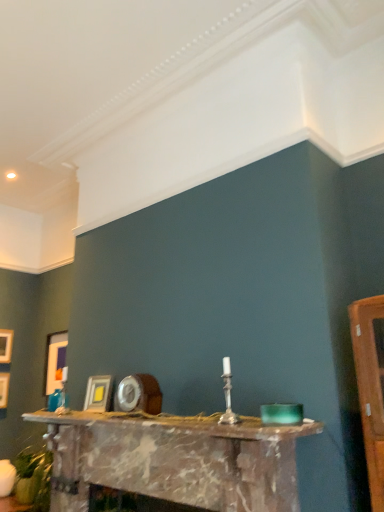
Measure the distance between point (90, 378) and camera.

They are 2.68 meters apart.

Locate an element on the screen. This screenshot has height=512, width=384. wooden picture frame at left, positioned as the 4th picture frame in front-to-back order is located at coordinates (6, 345).

This screenshot has height=512, width=384. Describe the element at coordinates (174, 460) in the screenshot. I see `marble fireplace at center` at that location.

Measure the distance between matte white picture frame at left, the 3th picture frame in the back-to-front sequence, and camera.

The depth of matte white picture frame at left, the 3th picture frame in the back-to-front sequence, is 3.53 meters.

Image resolution: width=384 pixels, height=512 pixels. Identify the location of matte white picture frame at left, which ranks as the third picture frame in left-to-right order. (55, 361).

Locate an element on the screen. The width and height of the screenshot is (384, 512). matte gold picture frame at center, the 1th picture frame viewed from the front is located at coordinates (98, 393).

Considering the sizes of objects matte gold picture frame at center, marked as the fourth picture frame in a back-to-front arrangement, and matte white picture frame at left, which ranks as the third picture frame in left-to-right order, in the image provided, who is smaller, matte gold picture frame at center, marked as the fourth picture frame in a back-to-front arrangement, or matte white picture frame at left, which ranks as the third picture frame in left-to-right order,?

Smaller between the two is matte gold picture frame at center, marked as the fourth picture frame in a back-to-front arrangement.

Does matte gold picture frame at center, the 1th picture frame viewed from the front, appear on the left side of matte white picture frame at left, the second picture frame from the front?

No.

From the image's perspective, is matte gold picture frame at center, the 1th picture frame from the right, located beneath matte white picture frame at left, the 3th picture frame in the back-to-front sequence?

No, from the image's perspective, matte gold picture frame at center, the 1th picture frame from the right, is not beneath matte white picture frame at left, the 3th picture frame in the back-to-front sequence.

Identify the location of picture frame that is the 1st one when counting backward from the matte gold picture frame at center, the 1th picture frame viewed from the front. Image resolution: width=384 pixels, height=512 pixels. (55, 361).

Is matte gold picture frame at left, arranged as the third picture frame when viewed from the right, bigger than wooden picture frame at left, which appears as the 1th picture frame when viewed from the back?

Yes.

Is matte gold picture frame at left, the third picture frame viewed from the front, situated inside wooden picture frame at left, the fourth picture frame in the right-to-left sequence, or outside?

matte gold picture frame at left, the third picture frame viewed from the front, is spatially situated outside wooden picture frame at left, the fourth picture frame in the right-to-left sequence.

In terms of width, does matte gold picture frame at left, which ranks as the second picture frame in back-to-front order, look wider or thinner when compared to wooden picture frame at left, the fourth picture frame in the right-to-left sequence?

Clearly, matte gold picture frame at left, which ranks as the second picture frame in back-to-front order, has more width compared to wooden picture frame at left, the fourth picture frame in the right-to-left sequence.

Would you consider matte gold picture frame at left, arranged as the third picture frame when viewed from the right, to be distant from wooden picture frame at left, the fourth picture frame in the right-to-left sequence?

No, there isn't a large distance between matte gold picture frame at left, arranged as the third picture frame when viewed from the right, and wooden picture frame at left, the fourth picture frame in the right-to-left sequence.

Does matte gold picture frame at left, the third picture frame viewed from the front, have a greater height compared to matte gold picture frame at center, the 4th picture frame positioned from the left?

Correct, matte gold picture frame at left, the third picture frame viewed from the front, is much taller as matte gold picture frame at center, the 4th picture frame positioned from the left.

Is point (1, 382) closer to camera compared to point (103, 382)?

No, (1, 382) is further to viewer.

How different are the orientations of matte gold picture frame at left, which ranks as the second picture frame in left-to-right order, and matte gold picture frame at center, the 1th picture frame viewed from the front, in degrees?

The facing directions of matte gold picture frame at left, which ranks as the second picture frame in left-to-right order, and matte gold picture frame at center, the 1th picture frame viewed from the front, are 90.4 degrees apart.

Considering the relative positions of matte white picture frame at left, the 3th picture frame in the back-to-front sequence, and marble fireplace at center in the image provided, is matte white picture frame at left, the 3th picture frame in the back-to-front sequence, to the left of marble fireplace at center from the viewer's perspective?

Yes.

From the image's perspective, is matte white picture frame at left, which ranks as the third picture frame in left-to-right order, above marble fireplace at center?

Indeed, from the image's perspective, matte white picture frame at left, which ranks as the third picture frame in left-to-right order, is shown above marble fireplace at center.

Is matte white picture frame at left, which ranks as the third picture frame in left-to-right order, far from marble fireplace at center?

matte white picture frame at left, which ranks as the third picture frame in left-to-right order, is far away from marble fireplace at center.

From the image's perspective, which is above, wooden picture frame at left, which appears as the 1th picture frame when viewed from the back, or matte gold picture frame at center, the 1th picture frame from the right?

wooden picture frame at left, which appears as the 1th picture frame when viewed from the back.

How distant is wooden picture frame at left, positioned as the first picture frame in left-to-right order, from matte gold picture frame at center, the 1th picture frame from the right?

wooden picture frame at left, positioned as the first picture frame in left-to-right order, and matte gold picture frame at center, the 1th picture frame from the right, are 1.59 meters apart from each other.

Considering the positions of objects wooden picture frame at left, which appears as the 1th picture frame when viewed from the back, and matte gold picture frame at center, marked as the fourth picture frame in a back-to-front arrangement, in the image provided, who is more to the left, wooden picture frame at left, which appears as the 1th picture frame when viewed from the back, or matte gold picture frame at center, marked as the fourth picture frame in a back-to-front arrangement,?

wooden picture frame at left, which appears as the 1th picture frame when viewed from the back.

Starting from the matte gold picture frame at center, marked as the fourth picture frame in a back-to-front arrangement, which picture frame is the 3rd one to the left? Please provide its 2D coordinates.

[(6, 345)]

Which point is more distant from viewer, (95, 408) or (7, 345)?

The point (7, 345) is farther.

Can you confirm if matte gold picture frame at center, the 4th picture frame positioned from the left, is positioned to the right of wooden picture frame at left, which appears as the 1th picture frame when viewed from the back?

Yes, matte gold picture frame at center, the 4th picture frame positioned from the left, is to the right of wooden picture frame at left, which appears as the 1th picture frame when viewed from the back.

Can you tell me how much matte gold picture frame at center, marked as the fourth picture frame in a back-to-front arrangement, and wooden picture frame at left, the fourth picture frame in the right-to-left sequence, differ in facing direction?

There is a 90.4-degree angle between the facing directions of matte gold picture frame at center, marked as the fourth picture frame in a back-to-front arrangement, and wooden picture frame at left, the fourth picture frame in the right-to-left sequence.

In the scene shown: Does marble fireplace at center have a smaller size compared to matte gold picture frame at center, the 4th picture frame positioned from the left?

No, marble fireplace at center is not smaller than matte gold picture frame at center, the 4th picture frame positioned from the left.

Looking at this image, is marble fireplace at center not near matte gold picture frame at center, the 1th picture frame from the right?

marble fireplace at center is near matte gold picture frame at center, the 1th picture frame from the right, not far away.

In the scene shown: From the image's perspective, is marble fireplace at center beneath matte gold picture frame at center, marked as the fourth picture frame in a back-to-front arrangement?

Yes, from the image's perspective, marble fireplace at center is below matte gold picture frame at center, marked as the fourth picture frame in a back-to-front arrangement.

From a real-world perspective, does marble fireplace at center stand above matte gold picture frame at center, the 1th picture frame from the right?

No.

Which picture frame is the 1st one when counting from the left side of the matte gold picture frame at center, the 1th picture frame from the right? Please provide its 2D coordinates.

[(55, 361)]

The height and width of the screenshot is (512, 384). Find the location of `the 2nd picture frame positioned below the wooden picture frame at left, positioned as the 4th picture frame in front-to-back order (from a real-world perspective)`. the 2nd picture frame positioned below the wooden picture frame at left, positioned as the 4th picture frame in front-to-back order (from a real-world perspective) is located at coordinates (4, 389).

Considering their positions, is matte gold picture frame at left, arranged as the third picture frame when viewed from the right, positioned closer to wooden picture frame at left, which appears as the 1th picture frame when viewed from the back, than matte white picture frame at left, the second picture frame from the front?

matte gold picture frame at left, arranged as the third picture frame when viewed from the right, is closer to wooden picture frame at left, which appears as the 1th picture frame when viewed from the back.

Considering their positions, is matte gold picture frame at center, the 1th picture frame from the right, positioned closer to matte white picture frame at left, the 3th picture frame in the back-to-front sequence, than matte gold picture frame at left, which ranks as the second picture frame in left-to-right order?

matte gold picture frame at left, which ranks as the second picture frame in left-to-right order, is closer to matte white picture frame at left, the 3th picture frame in the back-to-front sequence.

Estimate the real-world distances between objects in this image. Which object is closer to matte white picture frame at left, the second picture frame in the right-to-left sequence, marble fireplace at center or matte gold picture frame at center, marked as the fourth picture frame in a back-to-front arrangement?

Among the two, matte gold picture frame at center, marked as the fourth picture frame in a back-to-front arrangement, is located nearer to matte white picture frame at left, the second picture frame in the right-to-left sequence.

Considering their positions, is marble fireplace at center positioned closer to wooden picture frame at left, the fourth picture frame in the right-to-left sequence, than matte gold picture frame at left, arranged as the third picture frame when viewed from the right?

matte gold picture frame at left, arranged as the third picture frame when viewed from the right, lies closer to wooden picture frame at left, the fourth picture frame in the right-to-left sequence, than the other object.

From the picture: From the image, which object appears to be nearer to marble fireplace at center, wooden picture frame at left, positioned as the first picture frame in left-to-right order, or matte white picture frame at left, the 3th picture frame in the back-to-front sequence?

Among the two, matte white picture frame at left, the 3th picture frame in the back-to-front sequence, is located nearer to marble fireplace at center.

Looking at the image, which one is located further to matte gold picture frame at left, arranged as the third picture frame when viewed from the right, marble fireplace at center or matte white picture frame at left, the 3th picture frame in the back-to-front sequence?

Based on the image, marble fireplace at center appears to be further to matte gold picture frame at left, arranged as the third picture frame when viewed from the right.

Which object lies further to the anchor point matte gold picture frame at center, the 4th picture frame positioned from the left, wooden picture frame at left, which appears as the 1th picture frame when viewed from the back, or matte white picture frame at left, which ranks as the third picture frame in left-to-right order?

Based on the image, wooden picture frame at left, which appears as the 1th picture frame when viewed from the back, appears to be further to matte gold picture frame at center, the 4th picture frame positioned from the left.

Considering their positions, is matte gold picture frame at center, the 1th picture frame viewed from the front, positioned further to marble fireplace at center than matte gold picture frame at left, the third picture frame viewed from the front?

matte gold picture frame at left, the third picture frame viewed from the front, is further to marble fireplace at center.

Find the location of a particular element. picture frame between marble fireplace at center and matte white picture frame at left, which ranks as the third picture frame in left-to-right order, in the front-back direction is located at coordinates (98, 393).

Where is `picture frame located between matte gold picture frame at left, which ranks as the second picture frame in left-to-right order, and matte gold picture frame at center, the 1th picture frame viewed from the front, in the left-right direction`? picture frame located between matte gold picture frame at left, which ranks as the second picture frame in left-to-right order, and matte gold picture frame at center, the 1th picture frame viewed from the front, in the left-right direction is located at coordinates (55, 361).

The width and height of the screenshot is (384, 512). I want to click on picture frame between wooden picture frame at left, positioned as the 4th picture frame in front-to-back order, and matte white picture frame at left, which ranks as the third picture frame in left-to-right order, from left to right, so click(x=4, y=389).